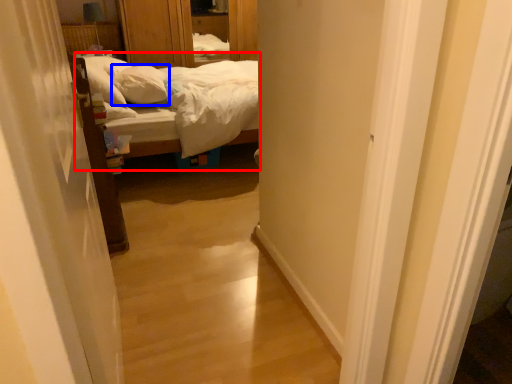
Question: Which of the following is the closest to the observer, bed (highlighted by a red box) or pillow (highlighted by a blue box)?

Choices:
 (A) bed
 (B) pillow

Answer: (A)